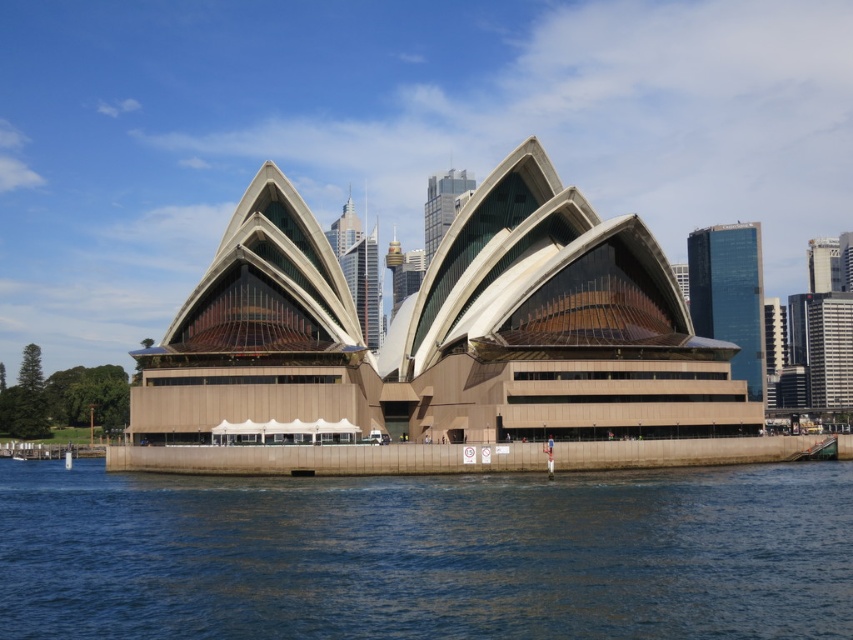
You are standing at the point marked as point (426, 554) in the image of the Sydney Opera House. What is the immediate environment around you?

The point (426, 554) is on blue water at lower center, so you are standing in the calm blue water near the waterfront of the Sydney Opera House.

You are standing on the dock near the blue water at lower center and want to reach the beige concrete opera house at center. Which direction should you head to move towards the opera house?

You should head north because the beige concrete opera house at center is located above the blue water at lower center.

You are a photographer planning to capture the Sydney Opera House from a low angle to emphasize its grandeur. You want to ensure that both the blue water at lower center and the beige concrete opera house at center are visible in the frame. Given their sizes, which object should you position closer to the edges of the frame to maintain balance?

The blue water at lower center has a smaller size compared to the beige concrete opera house at center. To maintain balance in the composition, position the larger beige concrete opera house at center near the edge opposite to the smaller blue water at lower center, ensuring both elements are visible while balancing their sizes.